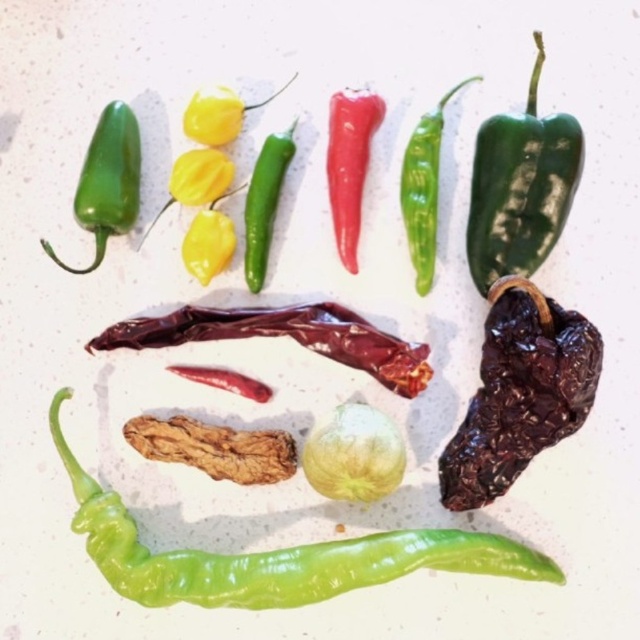
You are a chef preparing a dish and need to choose between the green glossy pepper at lower center and the green glossy chili pepper at left based on their size. Which one is taller?

The green glossy pepper at lower center is taller than the green glossy chili pepper at left.

You are a chef standing at a distance of 5 feet from the brown wrinkled pepper at center. Can you reach it without moving closer?

The brown wrinkled pepper at center is 4.46 feet away from the camera, so if you are standing 5 feet away, you cannot reach it without moving closer.

You are a chef preparing a dish and need to use both the green glossy pepper at lower center and the green glossy chili pepper at left. Which one is positioned higher up in the arrangement?

The green glossy chili pepper at left is positioned higher up because the green glossy pepper at lower center is located below it.